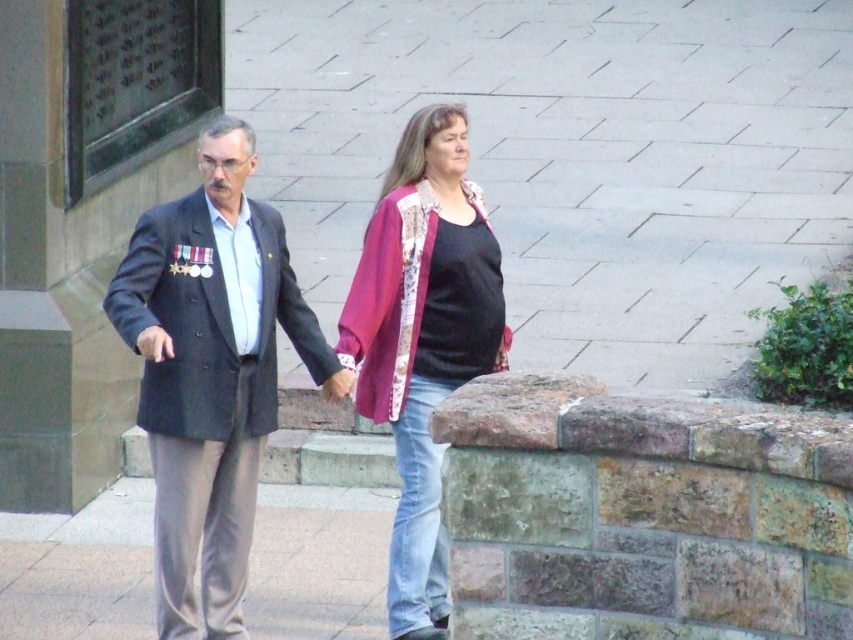
This screenshot has width=853, height=640. What do you see at coordinates (212, 372) in the screenshot? I see `dark gray suit at center` at bounding box center [212, 372].

Does dark gray suit at center appear under rustic patchwork cardigan at center?

Correct, dark gray suit at center is located below rustic patchwork cardigan at center.

Image resolution: width=853 pixels, height=640 pixels. Find the location of `dark gray suit at center`. dark gray suit at center is located at coordinates (212, 372).

I want to click on dark gray suit at center, so click(212, 372).